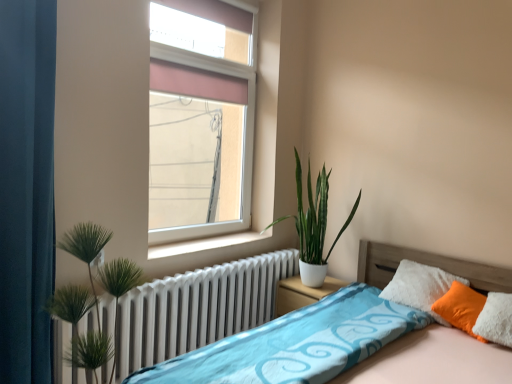
Question: Does teal fabric curtain at left appear on the right side of blue fabric bed at lower right?

Choices:
 (A) no
 (B) yes

Answer: (A)

Question: From the image's perspective, is teal fabric curtain at left above blue fabric bed at lower right?

Choices:
 (A) yes
 (B) no

Answer: (A)

Question: Does teal fabric curtain at left lie in front of blue fabric bed at lower right?

Choices:
 (A) no
 (B) yes

Answer: (A)

Question: Does teal fabric curtain at left come behind blue fabric bed at lower right?

Choices:
 (A) no
 (B) yes

Answer: (B)

Question: Is teal fabric curtain at left thinner than blue fabric bed at lower right?

Choices:
 (A) no
 (B) yes

Answer: (B)

Question: Relative to green glossy plant at center, is orange fabric pillow at right in front or behind?

Choices:
 (A) behind
 (B) front

Answer: (B)

Question: Would you say orange fabric pillow at right is to the left or to the right of green glossy plant at center in the picture?

Choices:
 (A) left
 (B) right

Answer: (B)

Question: From the image's perspective, relative to green glossy plant at center, is orange fabric pillow at right above or below?

Choices:
 (A) below
 (B) above

Answer: (A)

Question: Is orange fabric pillow at right wider or thinner than green glossy plant at center?

Choices:
 (A) wide
 (B) thin

Answer: (B)

Question: Do you think green leafy plant at left is within blue fabric bed at lower right, or outside of it?

Choices:
 (A) inside
 (B) outside

Answer: (B)

Question: Is point coord(82,221) positioned closer to the camera than point coord(475,347)?

Choices:
 (A) closer
 (B) farther

Answer: (A)

Question: From a real-world perspective, is green leafy plant at left positioned above or below blue fabric bed at lower right?

Choices:
 (A) below
 (B) above

Answer: (B)

Question: From the image's perspective, relative to blue fabric bed at lower right, is green leafy plant at left above or below?

Choices:
 (A) above
 (B) below

Answer: (A)

Question: Is point (336, 284) positioned closer to the camera than point (125, 340)?

Choices:
 (A) farther
 (B) closer

Answer: (A)

Question: Which is correct: white matte nightstand at center is inside white metallic radiator at lower left, or outside of it?

Choices:
 (A) outside
 (B) inside

Answer: (A)